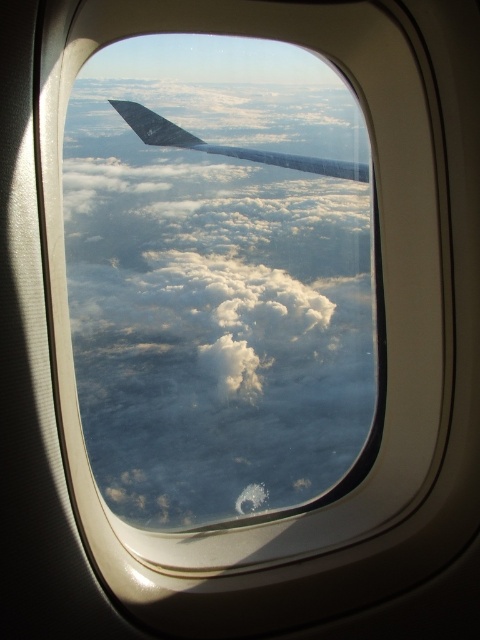
Is white fluffy cloud at center bigger than metallic gray wing at upper center?

Yes.

Which is above, white fluffy cloud at center or metallic gray wing at upper center?

metallic gray wing at upper center

Is point (104, 141) more distant than point (205, 145)?

No, (104, 141) is in front of (205, 145).

This screenshot has height=640, width=480. I want to click on white fluffy cloud at center, so click(217, 275).